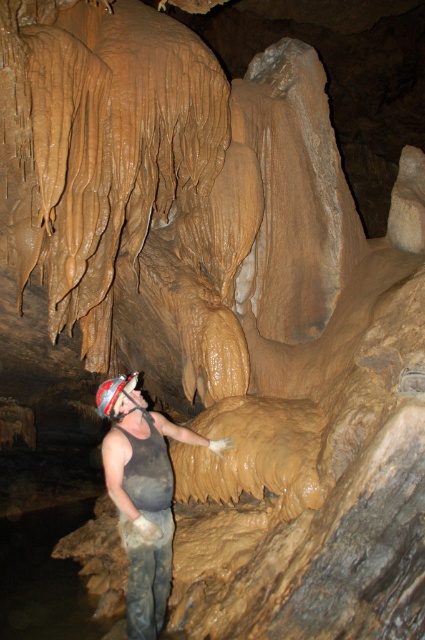
Question: Which object is closer to the camera taking this photo?

Choices:
 (A) shiny silver helmet at center
 (B) matte gray tank top at center

Answer: (B)

Question: Does matte gray tank top at center have a smaller size compared to shiny silver helmet at center?

Choices:
 (A) no
 (B) yes

Answer: (A)

Question: Observing the image, what is the correct spatial positioning of matte gray tank top at center in reference to shiny silver helmet at center?

Choices:
 (A) right
 (B) left

Answer: (A)

Question: Is matte gray tank top at center smaller than shiny silver helmet at center?

Choices:
 (A) no
 (B) yes

Answer: (A)